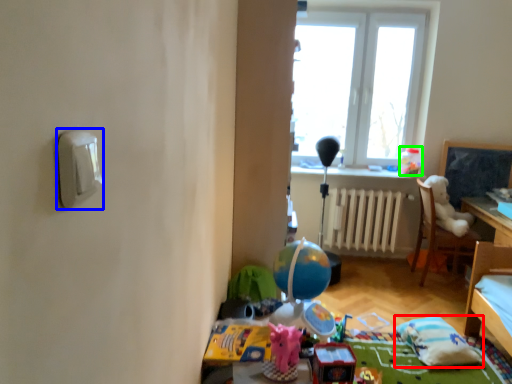
Question: Considering the real-world distances, which object is farthest from pillow (highlighted by a red box)? light switch (highlighted by a blue box) or toy (highlighted by a green box)?

Choices:
 (A) light switch
 (B) toy

Answer: (A)